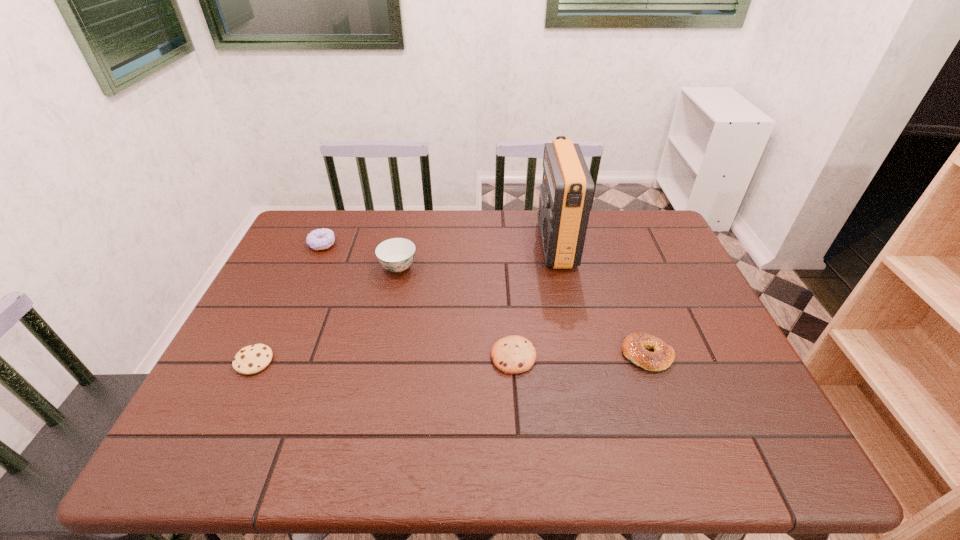
I want to click on radio receiver, so pos(566,193).

This screenshot has width=960, height=540. What are the coordinates of `the tallest object` in the screenshot? It's located at (566, 193).

Where is `the fourth object from right to left`? This screenshot has width=960, height=540. the fourth object from right to left is located at coordinates (396, 254).

Locate an element on the screen. This screenshot has width=960, height=540. the fifth shortest object is located at coordinates (396, 254).

Identify the location of doughnut. (320, 239).

Locate an element on the screen. This screenshot has width=960, height=540. the rightmost object is located at coordinates (634, 347).

The height and width of the screenshot is (540, 960). What are the coordinates of `the third object from right to left` in the screenshot? It's located at (513, 354).

Where is `the left cookie`? the left cookie is located at coordinates coord(249,360).

This screenshot has height=540, width=960. What are the coordinates of `vacant space located 0.240m on the front-facing side of the radio receiver` in the screenshot? It's located at (464, 244).

Identify the location of free space located 0.220m on the front-facing side of the radio receiver. (469, 244).